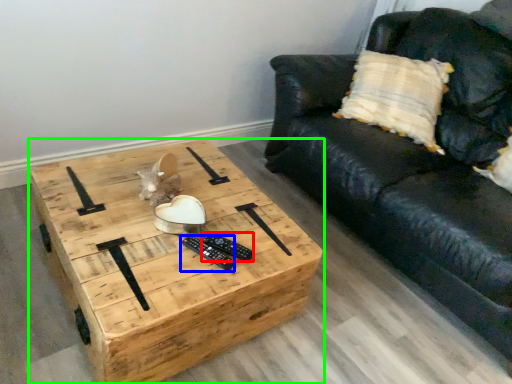
Question: Which object is positioned closest to remote (highlighted by a red box)? Select from remote (highlighted by a blue box) and coffee table (highlighted by a green box).

Choices:
 (A) remote
 (B) coffee table

Answer: (A)